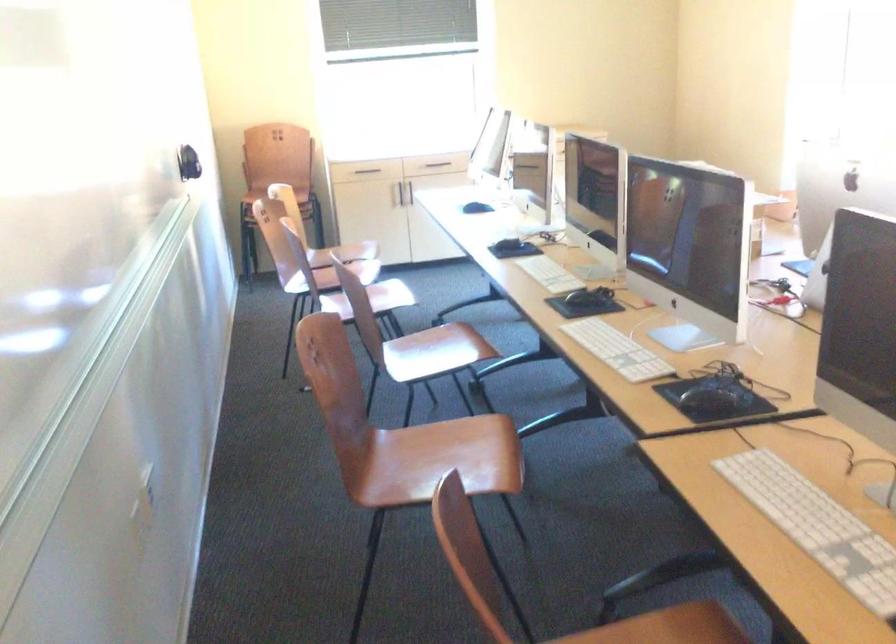
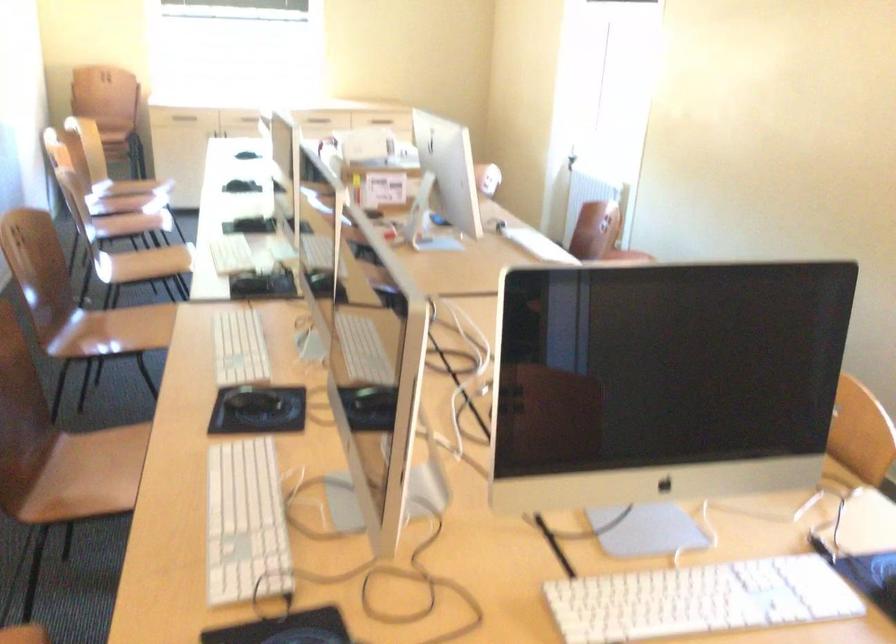
What movement of the cameraman would produce the second image?

The cameraman moved toward right, backward.